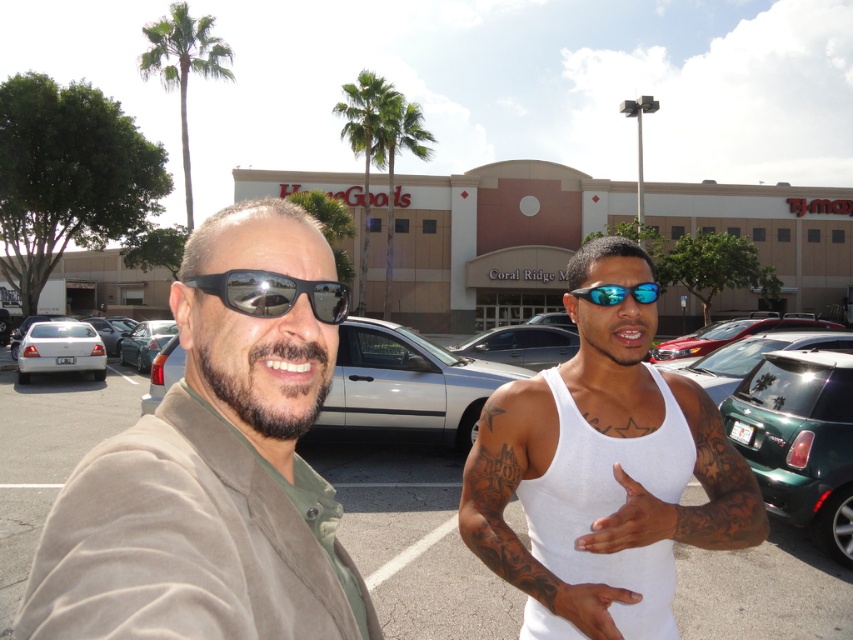
You are a delivery driver who needs to park your vehicle between the green matte car at right and the satin silver sedan at center. Considering their sizes, which car should you position your vehicle closer to for maximum space?

The green matte car at right has a smaller size compared to the satin silver sedan at center, so positioning your vehicle closer to the green matte car at right will provide more space due to its smaller size.